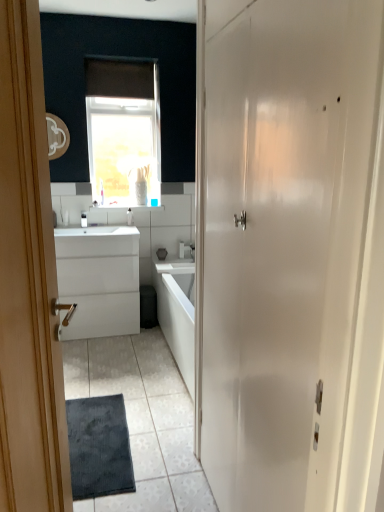
Question: Is white plastic toothbrush at center, which is the 2th toiletry in right-to-left order, at the left side of brown matte window at upper center?

Choices:
 (A) yes
 (B) no

Answer: (A)

Question: Is white plastic toothbrush at center, which is the 1th toiletry in left-to-right order, wider than brown matte window at upper center?

Choices:
 (A) yes
 (B) no

Answer: (A)

Question: From a real-world perspective, is white plastic toothbrush at center, which is the 2th toiletry in right-to-left order, below brown matte window at upper center?

Choices:
 (A) yes
 (B) no

Answer: (A)

Question: Does white plastic toothbrush at center, which is the 1th toiletry in left-to-right order, have a lesser width compared to brown matte window at upper center?

Choices:
 (A) yes
 (B) no

Answer: (B)

Question: Is white plastic toothbrush at center, which is the 1th toiletry in left-to-right order, outside of brown matte window at upper center?

Choices:
 (A) no
 (B) yes

Answer: (B)

Question: Is white plastic toothbrush at center, which is the 2th toiletry in right-to-left order, next to brown matte window at upper center and touching it?

Choices:
 (A) yes
 (B) no

Answer: (B)

Question: Does white glossy door at right, positioned as the second door in left-to-right order, have a greater height compared to dark gray textured mat at lower left?

Choices:
 (A) no
 (B) yes

Answer: (B)

Question: Would you consider white glossy door at right, positioned as the second door in left-to-right order, to be distant from dark gray textured mat at lower left?

Choices:
 (A) no
 (B) yes

Answer: (B)

Question: Would you say white glossy door at right, positioned as the second door in left-to-right order, is outside dark gray textured mat at lower left?

Choices:
 (A) yes
 (B) no

Answer: (A)

Question: Is white glossy door at right, which ranks as the first door in right-to-left order, bigger than dark gray textured mat at lower left?

Choices:
 (A) yes
 (B) no

Answer: (A)

Question: Is dark gray textured mat at lower left inside white glossy door at right, positioned as the second door in left-to-right order?

Choices:
 (A) yes
 (B) no

Answer: (B)

Question: Is white glossy door at right, which ranks as the first door in right-to-left order, thinner than dark gray textured mat at lower left?

Choices:
 (A) no
 (B) yes

Answer: (B)

Question: Is white plastic toothbrush at upper center, which ranks as the first toiletry in right-to-left order, wider than white glossy door at right, which ranks as the first door in right-to-left order?

Choices:
 (A) yes
 (B) no

Answer: (B)